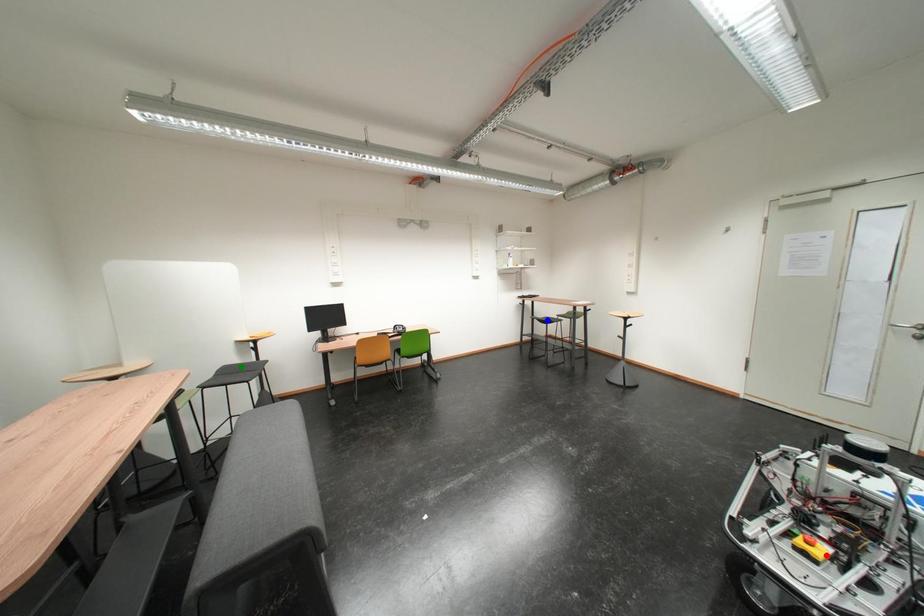
Order these from nearest to farthest:
green point, blue point, red point

1. red point
2. green point
3. blue point